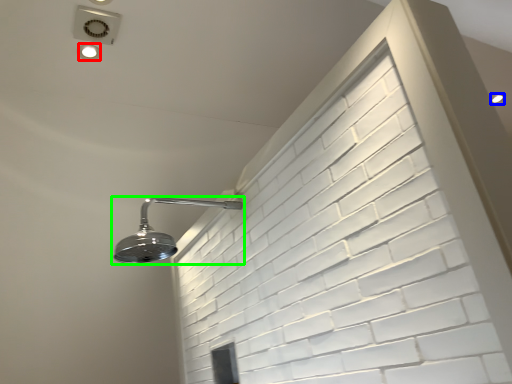
Question: Which is farther away from droplight (highlighted by a red box)? droplight (highlighted by a blue box) or shower (highlighted by a green box)?

Choices:
 (A) droplight
 (B) shower

Answer: (A)